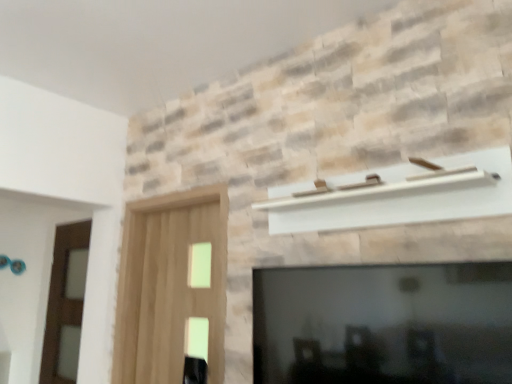
Question: From their relative heights in the image, would you say light brown wood screen door at left, which is the 2th screen door from left to right, is taller or shorter than brown wooden screen door at left, which is the 1th screen door in back-to-front order?

Choices:
 (A) short
 (B) tall

Answer: (A)

Question: From the image's perspective, is light brown wood screen door at left, which is counted as the first screen door, starting from the front, located above or below brown wooden screen door at left, which is the first screen door in left-to-right order?

Choices:
 (A) below
 (B) above

Answer: (B)

Question: Estimate the real-world distances between objects in this image. Which object is farther from the brown wooden screen door at left, which is the 1th screen door in back-to-front order?

Choices:
 (A) black glass fireplace at lower center
 (B) light brown wood screen door at left, which is the 2th screen door from left to right

Answer: (A)

Question: Estimate the real-world distances between objects in this image. Which object is farther from the black glass fireplace at lower center?

Choices:
 (A) light brown wood screen door at left, which appears as the second screen door when viewed from the back
 (B) brown wooden screen door at left, which is the first screen door in left-to-right order

Answer: (B)